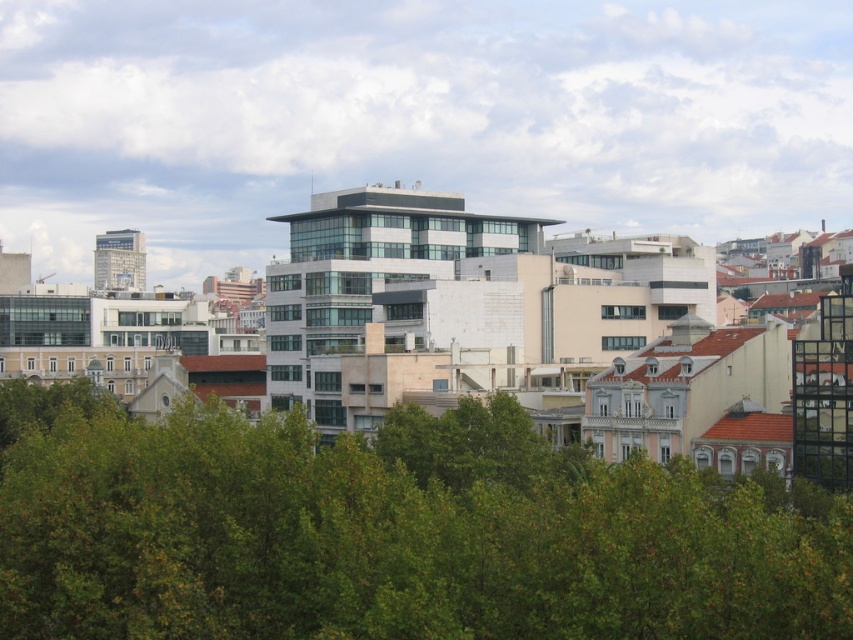
You are standing in the city park and see the green leafy tree at center and the matte glass skyscraper at left. Which object is closer to you?

The green leafy tree at center is closer to you because it is in front of the matte glass skyscraper at left.

You are a drone operator who needs to fly a drone from the green leafy tree at center to the matte glass skyscraper at left. According to the scene, will you need to fly the drone to the left or to the right to reach the skyscraper?

The green leafy tree at center is positioned on the right side of matte glass skyscraper at left, so to fly from the tree to the skyscraper, you would need to fly the drone to the left.

You are a city planner assessing the urban space between the green leafy tree at center and the matte glass skyscraper at left. Based on their widths, which one occupies more horizontal space in the image?

The green leafy tree at center might be wider than the matte glass skyscraper at left, so it likely occupies more horizontal space in the image.